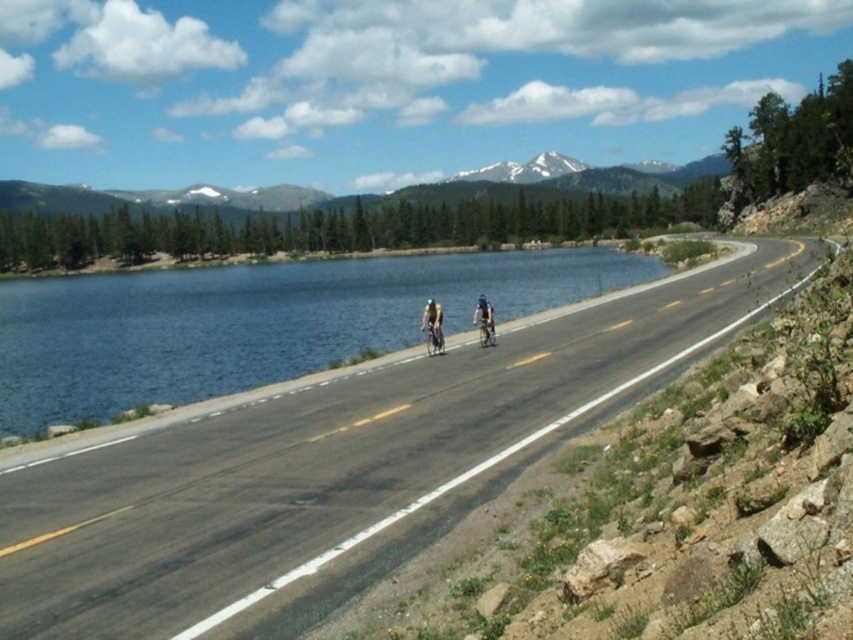
You are a pedestrian standing on the side of the road in the image. You see the white helmeted cyclist at center and the matte black bicycle at center. Which object is closer to you?

The white helmeted cyclist at center is closer to you than the matte black bicycle at center.

You are a delivery truck driver who needs to cross the asphalt road at center to reach the blue water at center for a quick stop. Considering the road width, is it possible for your 2.5 meter wide truck to safely navigate across the road to the water?

The asphalt road at center has a lesser width compared to blue water at center. Since the road is narrower than the water area, but the exact width isn not specified, it is uncertain if the 2.5 meter wide truck can safely navigate. However, if the road width is less than 2.5 meters, it would be too narrow. Without specific measurements, a safer assumption is that standard roads are typically wider than 2.5 meters, so it might be possible.

You are a delivery drone flying over the lake and need to land on the white helmeted cyclist at center. The coordinates provided are point (432,324). Can you confirm if this point is on the correct location?

Yes, the point (432,324) is on the white helmeted cyclist at center, so the drone can land there safely.